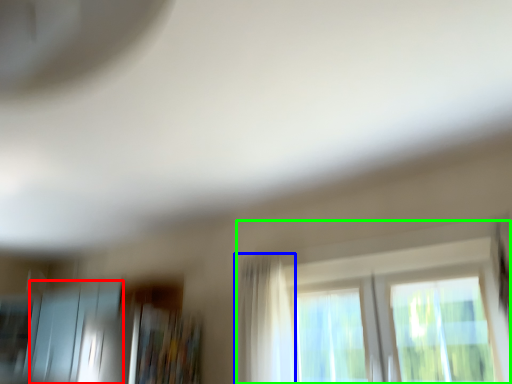
Question: Considering the real-world distances, which object is farthest from screen door (highlighted by a red box)? curtain (highlighted by a blue box) or window (highlighted by a green box)?

Choices:
 (A) curtain
 (B) window

Answer: (B)